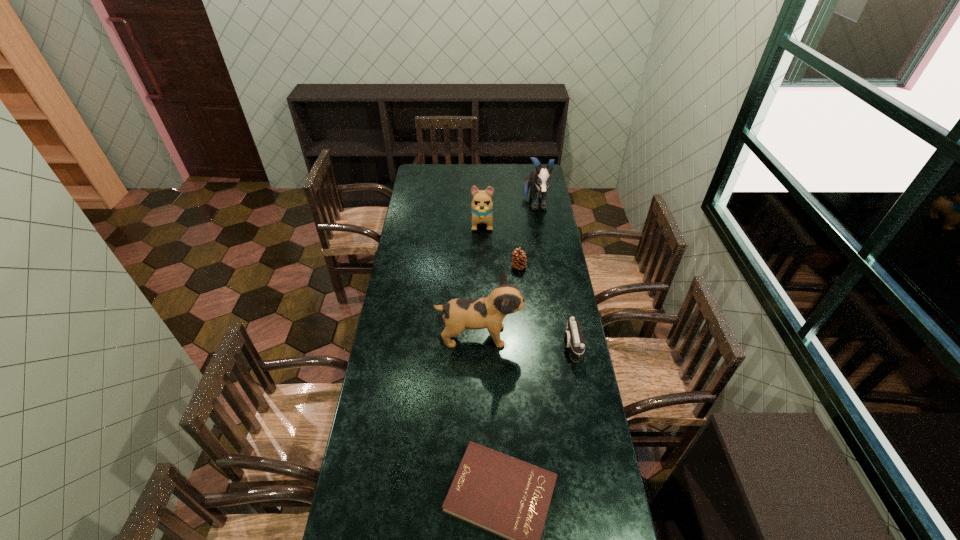
This screenshot has width=960, height=540. I want to click on free area in between the third tallest object and the camera, so click(527, 284).

Image resolution: width=960 pixels, height=540 pixels. What are the coordinates of `free space between the camera and the nearest puppy` in the screenshot? It's located at (525, 341).

Locate which object is the closest to the rightmost puppy. Please provide its 2D coordinates. Your answer should be formatted as a tuple, i.e. [(x, y)], where the tuple contains the x and y coordinates of a point satisfying the conditions above.

[(482, 206)]

Where is `the fifth closest object to the third farthest object`? The width and height of the screenshot is (960, 540). the fifth closest object to the third farthest object is located at coordinates (501, 494).

Choose which puppy is the second nearest neighbor to the rightmost puppy. Please provide its 2D coordinates. Your answer should be formatted as a tuple, i.e. [(x, y)], where the tuple contains the x and y coordinates of a point satisfying the conditions above.

[(459, 314)]

Identify which puppy is the third closest to the hardback book. Please provide its 2D coordinates. Your answer should be formatted as a tuple, i.e. [(x, y)], where the tuple contains the x and y coordinates of a point satisfying the conditions above.

[(539, 179)]

This screenshot has width=960, height=540. Find the location of `free point that satisfies the following two spatial constraints: 1. on the front side of the fourth nearest object; 2. at the face of the nearest puppy`. free point that satisfies the following two spatial constraints: 1. on the front side of the fourth nearest object; 2. at the face of the nearest puppy is located at coordinates (525, 336).

At what (x,y) coordinates should I click in order to perform the action: click on vacant space that satisfies the following two spatial constraints: 1. on the front-facing side of the rightmost puppy; 2. at the face of the nearest puppy. Please return your answer as a coordinate pair (x, y). The height and width of the screenshot is (540, 960). Looking at the image, I should click on (556, 336).